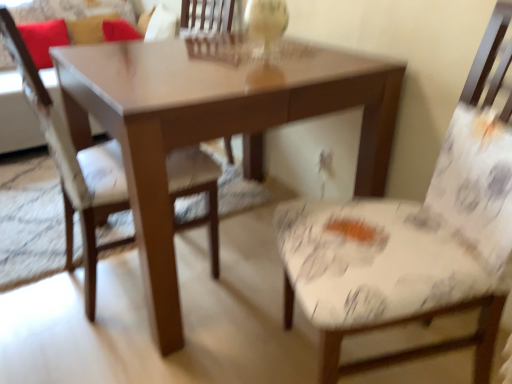
Question: From a real-world perspective, is matte brown table at center located higher than velvet red couch at upper left?

Choices:
 (A) yes
 (B) no

Answer: (B)

Question: Is matte brown table at center bigger than velvet red couch at upper left?

Choices:
 (A) no
 (B) yes

Answer: (A)

Question: Is matte brown table at center positioned far away from velvet red couch at upper left?

Choices:
 (A) yes
 (B) no

Answer: (A)

Question: Does matte brown table at center have a greater width compared to velvet red couch at upper left?

Choices:
 (A) no
 (B) yes

Answer: (A)

Question: From the image's perspective, is matte brown table at center located above velvet red couch at upper left?

Choices:
 (A) yes
 (B) no

Answer: (B)

Question: In the image, is white floral fabric chair at right, which ranks as the 2th chair in left-to-right order, positioned in front of or behind matte brown table at center?

Choices:
 (A) front
 (B) behind

Answer: (A)

Question: From the image's perspective, is white floral fabric chair at right, marked as the first chair in a right-to-left arrangement, positioned above or below matte brown table at center?

Choices:
 (A) above
 (B) below

Answer: (B)

Question: In terms of height, does white floral fabric chair at right, marked as the first chair in a right-to-left arrangement, look taller or shorter compared to matte brown table at center?

Choices:
 (A) tall
 (B) short

Answer: (A)

Question: Based on their positions, is white floral fabric chair at right, which ranks as the 2th chair in left-to-right order, located to the left or right of matte brown table at center?

Choices:
 (A) right
 (B) left

Answer: (A)

Question: Is velvet red pillow at upper left, which is the second pillow from left to right, in front of or behind velvet red couch at upper left in the image?

Choices:
 (A) behind
 (B) front

Answer: (A)

Question: Is velvet red pillow at upper left, the first pillow positioned from the right, to the left or to the right of velvet red couch at upper left in the image?

Choices:
 (A) right
 (B) left

Answer: (A)

Question: From the image's perspective, relative to velvet red couch at upper left, is velvet red pillow at upper left, the first pillow positioned from the right, above or below?

Choices:
 (A) above
 (B) below

Answer: (A)

Question: Is velvet red pillow at upper left, the first pillow positioned from the right, spatially inside velvet red couch at upper left, or outside of it?

Choices:
 (A) outside
 (B) inside

Answer: (B)

Question: Is matte brown table at center taller or shorter than red fabric pillow at upper left, which ranks as the 1th pillow in left-to-right order?

Choices:
 (A) tall
 (B) short

Answer: (A)

Question: Does point (362, 142) appear closer or farther from the camera than point (31, 36)?

Choices:
 (A) farther
 (B) closer

Answer: (B)